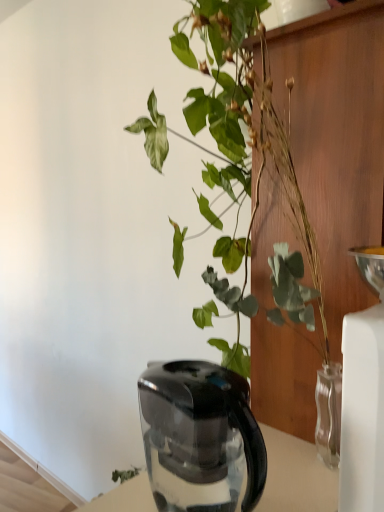
Question: Does point (198, 420) appear closer or farther from the camera than point (221, 26)?

Choices:
 (A) closer
 (B) farther

Answer: (A)

Question: From a real-world perspective, is black plastic kettle at lower center positioned above or below green glossy plant at upper center?

Choices:
 (A) above
 (B) below

Answer: (B)

Question: From the image's perspective, is black plastic kettle at lower center positioned above or below green glossy plant at upper center?

Choices:
 (A) below
 (B) above

Answer: (A)

Question: From a real-world perspective, relative to black plastic kettle at lower center, is green glossy plant at upper center vertically above or below?

Choices:
 (A) above
 (B) below

Answer: (A)

Question: Considering the positions of green glossy plant at upper center and black plastic kettle at lower center in the image, is green glossy plant at upper center taller or shorter than black plastic kettle at lower center?

Choices:
 (A) short
 (B) tall

Answer: (B)

Question: Is green glossy plant at upper center in front of or behind black plastic kettle at lower center in the image?

Choices:
 (A) front
 (B) behind

Answer: (A)

Question: Considering the relative positions of green glossy plant at upper center and black plastic kettle at lower center in the image provided, is green glossy plant at upper center to the left or to the right of black plastic kettle at lower center?

Choices:
 (A) left
 (B) right

Answer: (B)